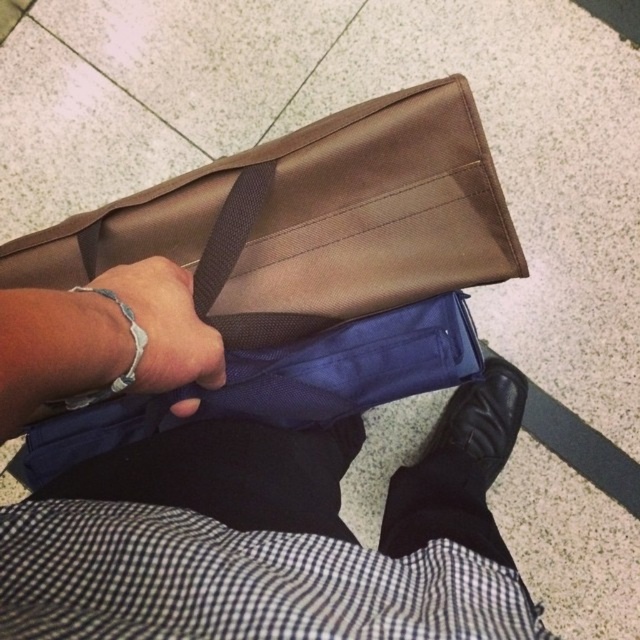
You are a security guard checking a person entering a secure area. You notice the silver metallic bracelet at center and the brown fabric strap at center on their wrist. According to the security policy, any item under another item on the wrist must be removed before proceeding. Can the person proceed as is?

The silver metallic bracelet at center is positioned under the brown fabric strap at center, so the person cannot proceed as is. They need to remove the silver metallic bracelet at center from under the brown fabric strap at center to comply with the security policy.

You are standing in front of a bag and need to place an item into it. The bag is located at point (257, 547). Can you confirm the exact location of the bag?

The point (257, 547) corresponds to the matte brown bag at upper center.

You are trying to decide whether to carry both the matte brown bag at upper center and the brown fabric strap at center. Since you have limited space, which one should you choose to take based on their sizes?

The matte brown bag at upper center is bigger than the brown fabric strap at center, so you should take the brown fabric strap at center to save space.